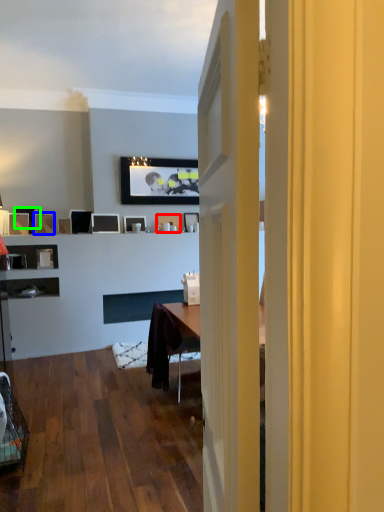
Question: Considering the real-world distances, which object is closest to picture frame (highlighted by a red box)? picture frame (highlighted by a blue box) or picture frame (highlighted by a green box).

Choices:
 (A) picture frame
 (B) picture frame

Answer: (A)